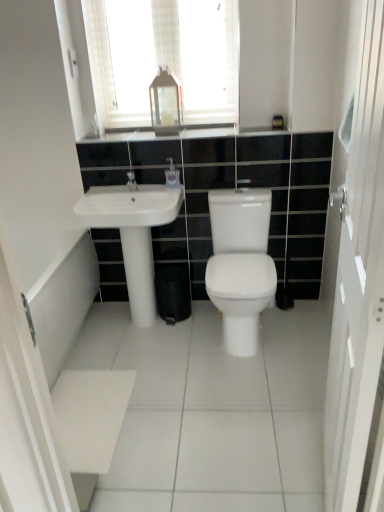
Question: From a real-world perspective, is white glossy soap dispenser at center under white glossy countertop at upper center?

Choices:
 (A) no
 (B) yes

Answer: (B)

Question: Is white glossy countertop at upper center surrounded by white glossy soap dispenser at center?

Choices:
 (A) no
 (B) yes

Answer: (A)

Question: Considering the relative sizes of white glossy soap dispenser at center and white glossy countertop at upper center in the image provided, is white glossy soap dispenser at center thinner than white glossy countertop at upper center?

Choices:
 (A) yes
 (B) no

Answer: (A)

Question: Is white glossy soap dispenser at center positioned before white glossy countertop at upper center?

Choices:
 (A) yes
 (B) no

Answer: (B)

Question: Does white glossy soap dispenser at center turn towards white glossy countertop at upper center?

Choices:
 (A) no
 (B) yes

Answer: (A)

Question: From the image's perspective, is white glossy soap dispenser at center on top of white glossy countertop at upper center?

Choices:
 (A) yes
 (B) no

Answer: (B)

Question: From the image's perspective, would you say matte silver faucet at center is positioned over white glossy countertop at upper center?

Choices:
 (A) yes
 (B) no

Answer: (B)

Question: Is matte silver faucet at center shorter than white glossy countertop at upper center?

Choices:
 (A) yes
 (B) no

Answer: (B)

Question: Is matte silver faucet at center wider than white glossy countertop at upper center?

Choices:
 (A) no
 (B) yes

Answer: (A)

Question: Is matte silver faucet at center touching white glossy countertop at upper center?

Choices:
 (A) no
 (B) yes

Answer: (A)

Question: From the image's perspective, would you say matte silver faucet at center is shown under white glossy countertop at upper center?

Choices:
 (A) no
 (B) yes

Answer: (B)

Question: Is matte silver faucet at center thinner than white glossy countertop at upper center?

Choices:
 (A) yes
 (B) no

Answer: (A)

Question: Is white glossy soap dispenser at center looking in the opposite direction of white textured mirror at upper center?

Choices:
 (A) no
 (B) yes

Answer: (A)